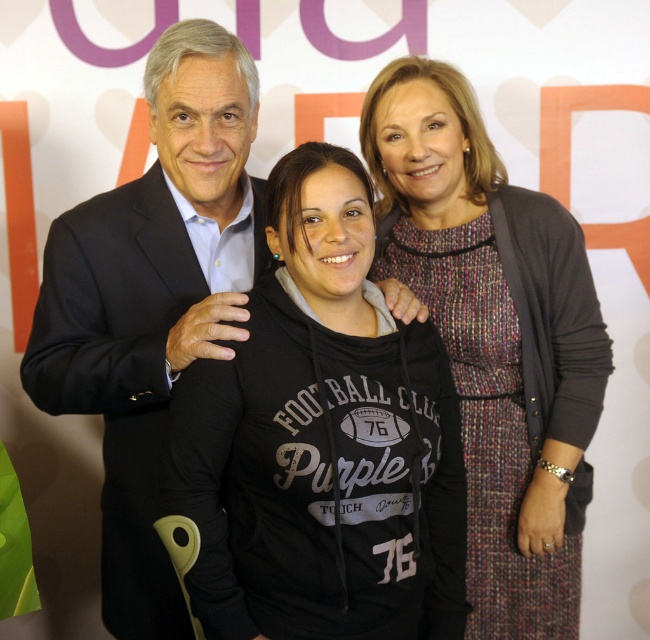
Question: Is black hoodie at center thinner than dark suit at center?

Choices:
 (A) no
 (B) yes

Answer: (A)

Question: Is black hoodie at center wider than dark suit at center?

Choices:
 (A) yes
 (B) no

Answer: (A)

Question: Which point is closer to the camera?

Choices:
 (A) black hoodie at center
 (B) knitted sweater at center
 (C) dark suit at center

Answer: (A)

Question: Which of the following is the closest to the observer?

Choices:
 (A) (406, 273)
 (B) (333, 400)

Answer: (B)

Question: Which object is the farthest from the dark suit at center?

Choices:
 (A) knitted sweater at center
 (B) black hoodie at center

Answer: (A)

Question: Is black hoodie at center to the right of dark suit at center from the viewer's perspective?

Choices:
 (A) no
 (B) yes

Answer: (B)